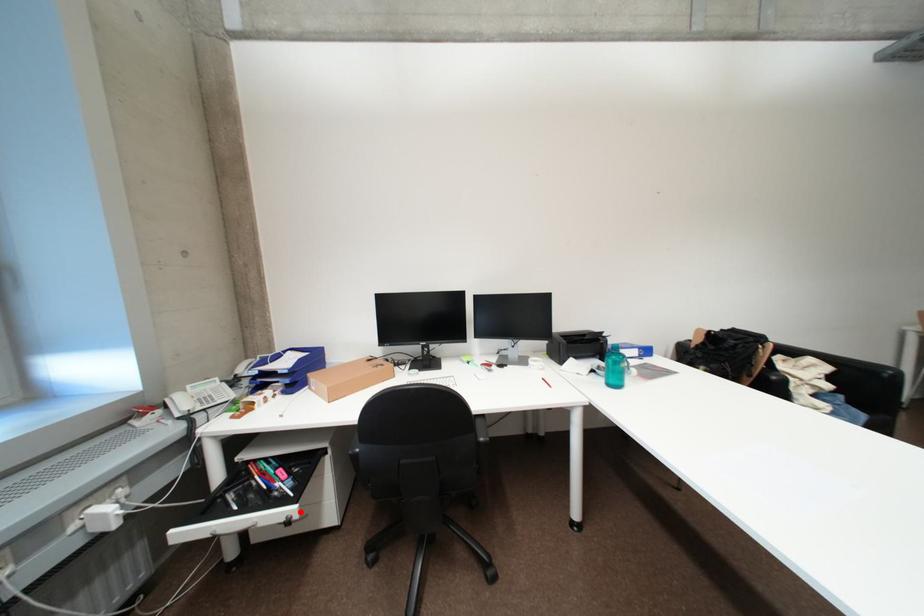
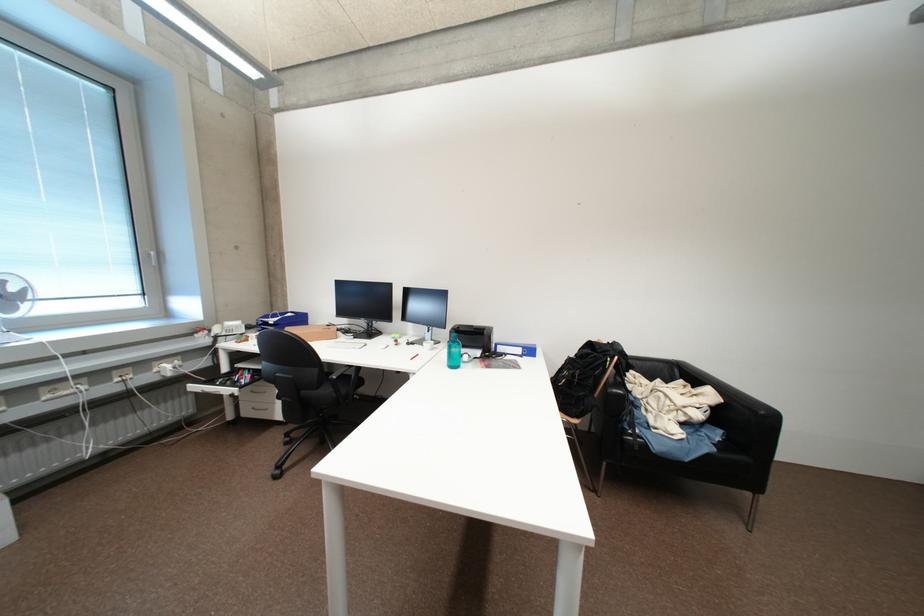
Where in the second image is the point corresponding to the highlighted location from the first image?

(244, 392)